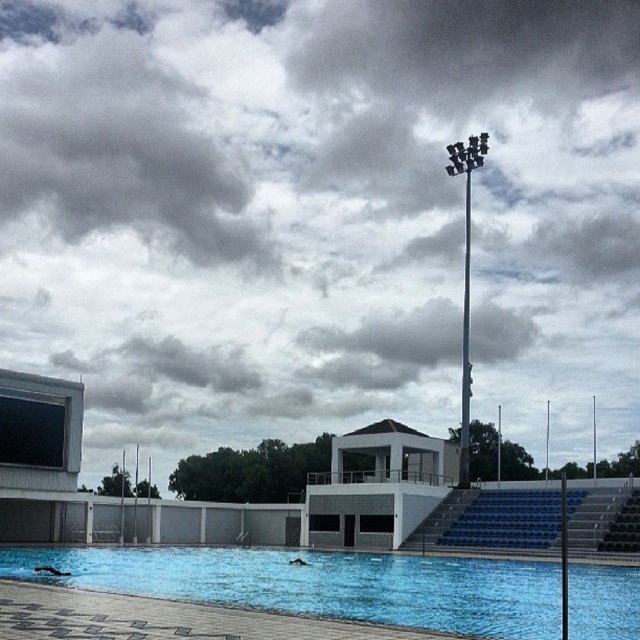
Is blue smooth water at center to the right of metallic pole at center-right from the viewer's perspective?

No, blue smooth water at center is not to the right of metallic pole at center-right.

Is blue smooth water at center shorter than metallic pole at center-right?

In fact, blue smooth water at center may be taller than metallic pole at center-right.

Does point (152, 595) come in front of point (563, 483)?

Yes, it is.

Identify the location of blue smooth water at center. (323, 584).

The width and height of the screenshot is (640, 640). I want to click on blue smooth water at center, so tap(323, 584).

In the scene shown: Can you confirm if blue smooth water at center is positioned above silver metallic pole at upper center?

Actually, blue smooth water at center is below silver metallic pole at upper center.

Is point (604, 588) positioned before point (465, 442)?

That is True.

Find the location of a particular element. Image resolution: width=640 pixels, height=640 pixels. blue smooth water at center is located at coordinates (323, 584).

Is silver metallic pole at upper center closer to camera compared to metallic pole at center-right?

No, it is behind metallic pole at center-right.

Who is positioned more to the left, silver metallic pole at upper center or metallic pole at center-right?

From the viewer's perspective, metallic pole at center-right appears more on the left side.

Image resolution: width=640 pixels, height=640 pixels. What do you see at coordinates (465, 346) in the screenshot?
I see `silver metallic pole at upper center` at bounding box center [465, 346].

Find the location of `silver metallic pole at upper center`. silver metallic pole at upper center is located at coordinates (465, 346).